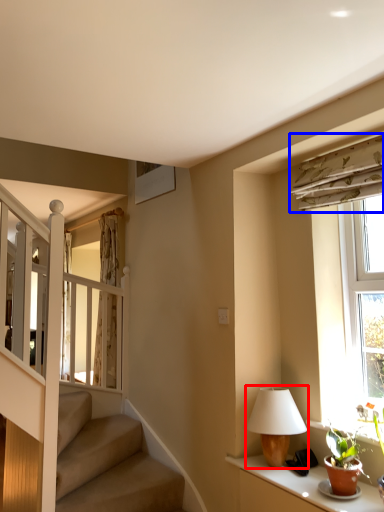
Question: Among these objects, which one is farthest to the camera, table lamp (highlighted by a red box) or curtain (highlighted by a blue box)?

Choices:
 (A) table lamp
 (B) curtain

Answer: (A)